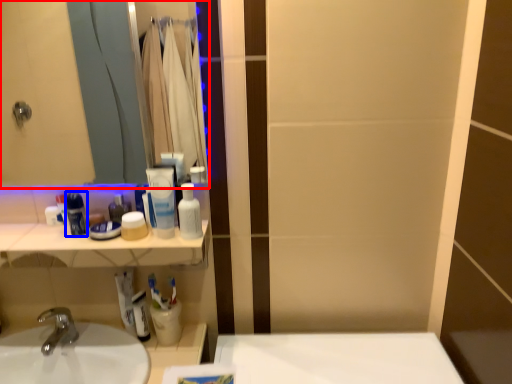
Question: Which object appears closest to the camera in this image, mirror (highlighted by a red box) or mouthwash (highlighted by a blue box)?

Choices:
 (A) mirror
 (B) mouthwash

Answer: (A)